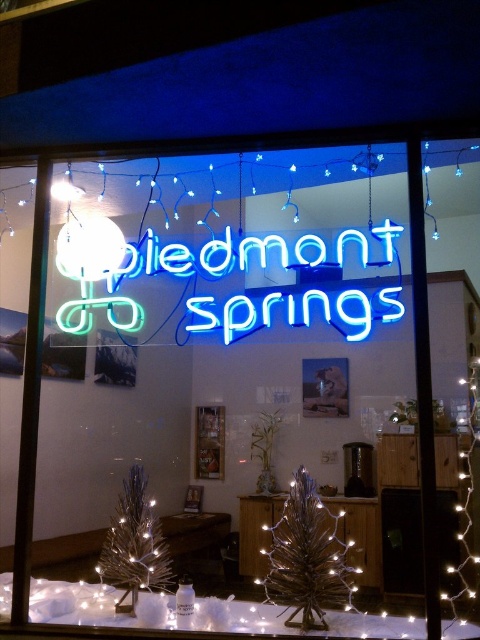
Is point (332, 324) positioned after point (135, 557)?

Yes, point (332, 324) is farther from viewer.

Can you confirm if neon blue sign at center is positioned below iridescent metallic christmas tree at lower left?

Incorrect, neon blue sign at center is not positioned below iridescent metallic christmas tree at lower left.

Who is more forward, [120,328] or [112,524]?

Point [112,524]

Locate an element on the screen. The height and width of the screenshot is (640, 480). neon blue sign at center is located at coordinates (201, 291).

Does neon blue sign at center have a greater width compared to iridescent metallic christmas tree at center?

Indeed, neon blue sign at center has a greater width compared to iridescent metallic christmas tree at center.

The height and width of the screenshot is (640, 480). Identify the location of neon blue sign at center. (201, 291).

Describe the element at coordinates (308, 557) in the screenshot. The height and width of the screenshot is (640, 480). I see `iridescent metallic christmas tree at center` at that location.

Is point (312, 477) positioned after point (132, 541)?

Yes, it is.

Who is more distant from viewer, (264,580) or (145,531)?

Positioned behind is point (145,531).

Where is `iridescent metallic christmas tree at center`? Image resolution: width=480 pixels, height=640 pixels. iridescent metallic christmas tree at center is located at coordinates (308, 557).